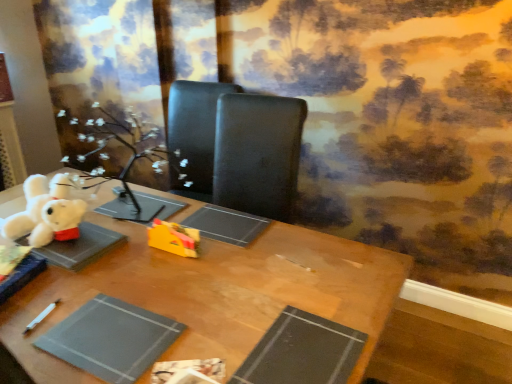
This screenshot has height=384, width=512. Identify the location of vacant area that lies between gray matte paper at lower left, which ranks as the 2th paperback book in right-to-left order, and yellow plastic toy at center, which appears as the second toy when viewed from the left. (153, 282).